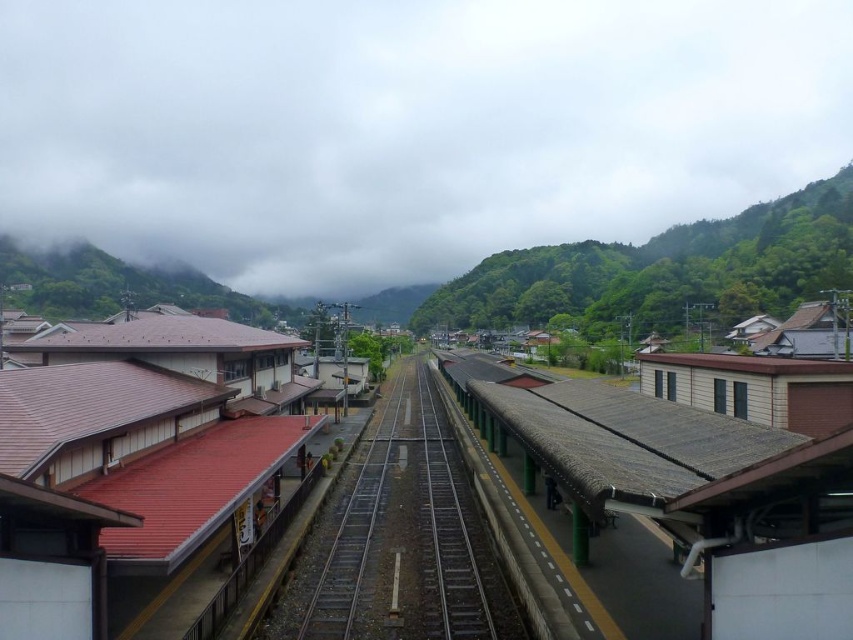
Question: Does cloudy sky at upper center have a smaller size compared to brown thatched roof platform at center?

Choices:
 (A) yes
 (B) no

Answer: (B)

Question: Which point is farther from the camera taking this photo?

Choices:
 (A) (563, 163)
 (B) (573, 518)
 (C) (103, 401)
 (D) (416, 592)

Answer: (A)

Question: Which point is farther to the camera?

Choices:
 (A) green corrugated metal train track at center
 (B) brown thatched roof platform at center
 (C) cloudy sky at upper center

Answer: (C)

Question: Does brown thatched roof platform at center have a lesser width compared to green corrugated metal train track at center?

Choices:
 (A) yes
 (B) no

Answer: (B)

Question: In this image, where is brown thatched roof platform at center located relative to green corrugated metal train track at center?

Choices:
 (A) right
 (B) left

Answer: (A)

Question: Which point is farther from the camera taking this photo?

Choices:
 (A) (241, 369)
 (B) (752, 628)
 (C) (428, 515)

Answer: (A)